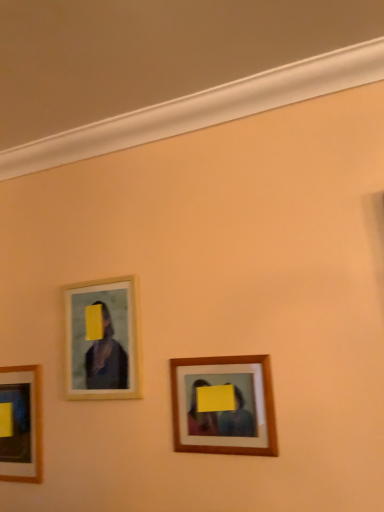
Question: Considering their positions, is wooden frame at upper left, which is the 2th picture frame in left-to-right order, located in front of or behind wooden frame at center, acting as the first picture frame starting from the right?

Choices:
 (A) front
 (B) behind

Answer: (B)

Question: Is point (100, 374) closer or farther from the camera than point (251, 360)?

Choices:
 (A) farther
 (B) closer

Answer: (A)

Question: Which of these objects is positioned farthest from the matte wooden picture frame at lower left, placed as the 3th picture frame when sorted from front to back?

Choices:
 (A) wooden frame at upper left, the second picture frame when ordered from right to left
 (B) wooden frame at center, the third picture frame from the back

Answer: (B)

Question: Which object is the farthest from the wooden frame at center, the third picture frame from the back?

Choices:
 (A) wooden frame at upper left, which is the 2th picture frame in left-to-right order
 (B) matte wooden picture frame at lower left, which is counted as the 1th picture frame, starting from the back

Answer: (B)